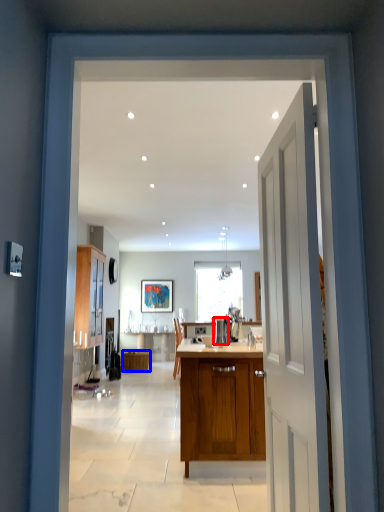
Question: Which object is further to the camera taking this photo, appliance (highlighted by a red box) or cabinetry (highlighted by a blue box)?

Choices:
 (A) appliance
 (B) cabinetry

Answer: (B)